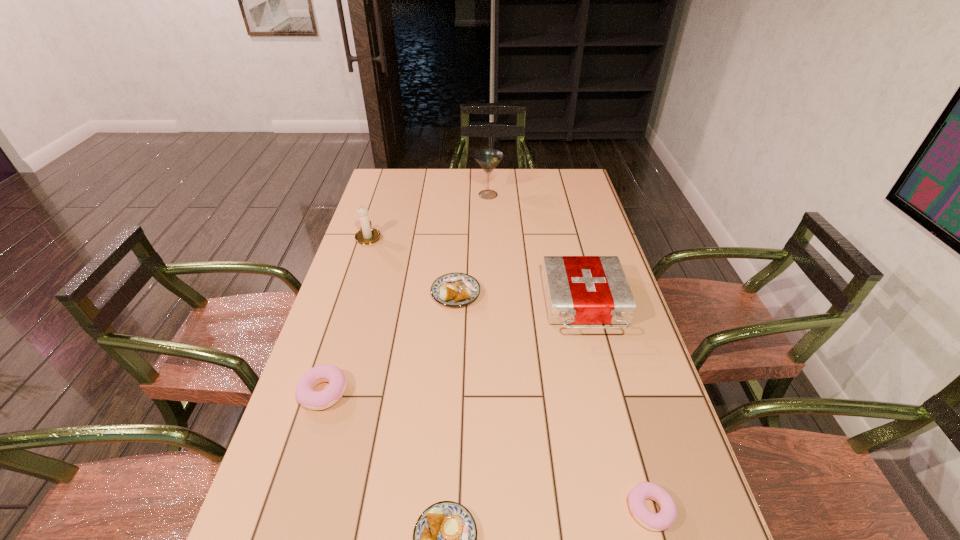
Find the location of a particular element. Image resolution: width=960 pixels, height=540 pixels. free space between the tallest object and the nearer pink pastry is located at coordinates (569, 352).

What are the coordinates of `free space between the bigger brown pastry and the tallest object` in the screenshot? It's located at (472, 244).

You are a GUI agent. You are given a task and a screenshot of the screen. Output one action in this format:
    pyautogui.click(x=<x>, y=<y>)
    Task: Click on the free space between the sixth nearest object and the farthest pastry
    Image resolution: width=960 pixels, height=540 pixels.
    Given the screenshot: What is the action you would take?
    pyautogui.click(x=412, y=265)

This screenshot has width=960, height=540. I want to click on free area in between the third nearest object and the second farthest object, so click(x=347, y=314).

What are the coordinates of `empty location between the farthest object and the red first-aid kit` in the screenshot? It's located at (537, 249).

At what (x,y) coordinates should I click in order to perform the action: click on the fourth closest object to the tallest object. Please return your answer as a coordinate pair (x, y). Looking at the image, I should click on (306, 396).

Select which object is the fourth closest to the white candle holder. Please provide its 2D coordinates. Your answer should be formatted as a tuple, i.e. [(x, y)], where the tuple contains the x and y coordinates of a point satisfying the conditions above.

[(578, 289)]

Where is `pastry that can be found as the third closest to the smaller brown pastry`? pastry that can be found as the third closest to the smaller brown pastry is located at coordinates (453, 289).

Locate an element on the screen. The image size is (960, 540). the closest pastry to the farther brown pastry is located at coordinates (306, 396).

Find the location of `brown pastry that is the closest to the nearer pink pastry`. brown pastry that is the closest to the nearer pink pastry is located at coordinates (445, 535).